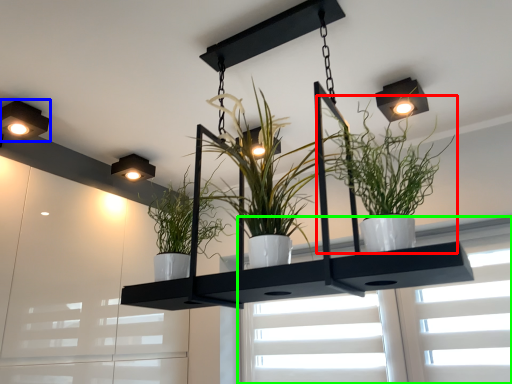
Question: Which is nearer to the houseplant (highlighted by a red box)? lamp (highlighted by a blue box) or window (highlighted by a green box).

Choices:
 (A) lamp
 (B) window

Answer: (B)